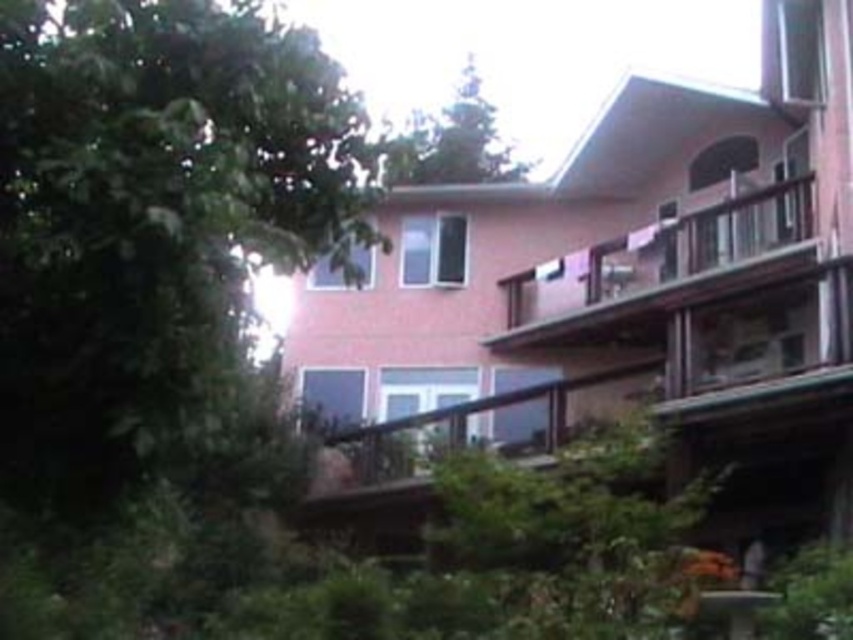
You are standing in front of the two story residential building with light pink exterior wall. You want to locate the brown wooden balcony at upper right. Where exactly is it located in terms of coordinates?

The brown wooden balcony at upper right is located at point [664,264].

You are standing in front of the two story residential building with light pink exterior wall. You notice two points marked on the image. One is at point (604, 262) and the other is at point (457, 176). Which of these two points is closer to you?

Point (604, 262) is closer to the viewer than point (457, 176).